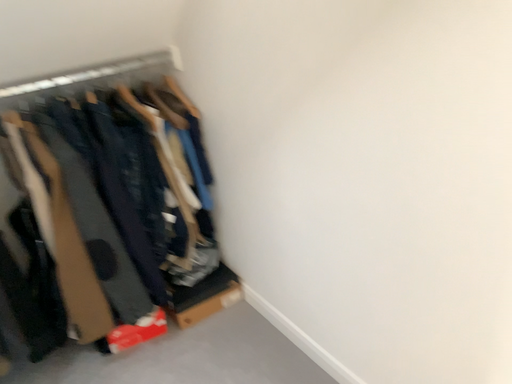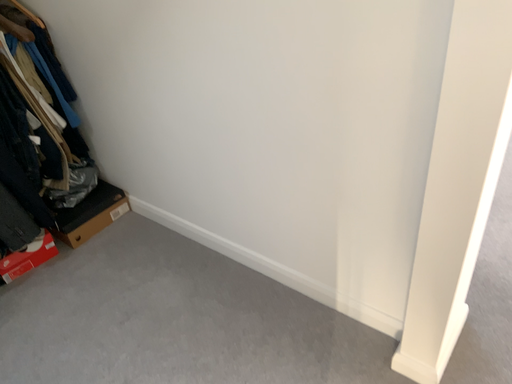
Question: Which way did the camera rotate in the video?

Choices:
 (A) rotated left
 (B) rotated right

Answer: (B)